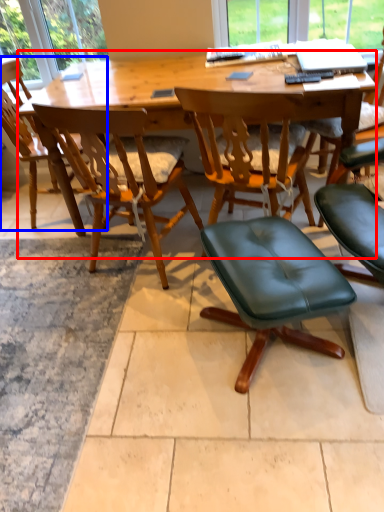
Question: Which object appears closest to the camera in this image, desk (highlighted by a red box) or chair (highlighted by a blue box)?

Choices:
 (A) desk
 (B) chair

Answer: (A)